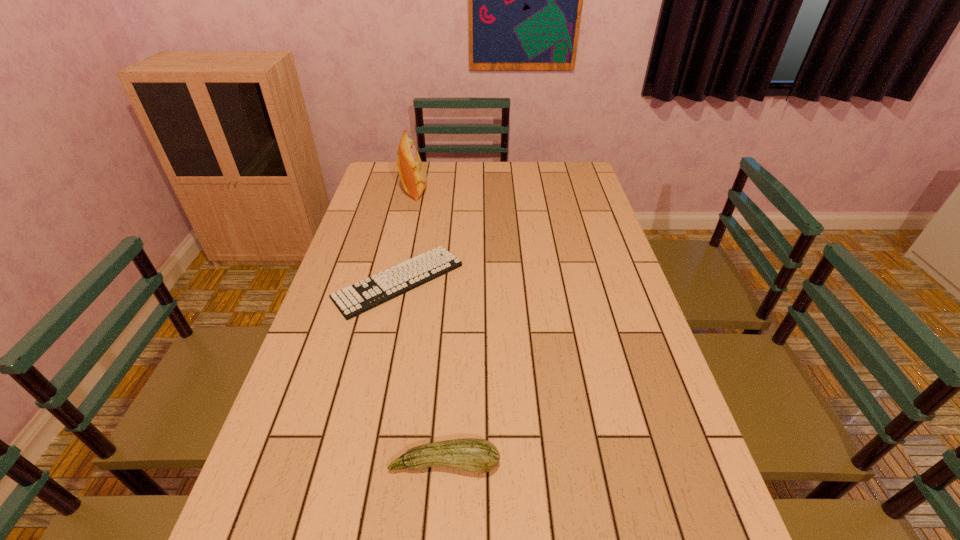
I want to click on empty location between the farthest object and the second nearest object, so click(x=406, y=236).

Where is `vacant point located between the shortest object and the second shortest object`? vacant point located between the shortest object and the second shortest object is located at coordinates (421, 372).

This screenshot has width=960, height=540. Find the location of `blank region between the tallest object and the nearest object`. blank region between the tallest object and the nearest object is located at coordinates click(430, 327).

The width and height of the screenshot is (960, 540). I want to click on unoccupied area between the zucchini and the crisp (potato chip), so 430,327.

The width and height of the screenshot is (960, 540). I want to click on empty location between the second farthest object and the farthest object, so click(x=406, y=236).

Find the location of a particular element. The height and width of the screenshot is (540, 960). free spot between the nearest object and the farthest object is located at coordinates (430, 327).

Image resolution: width=960 pixels, height=540 pixels. What are the coordinates of `vacant area between the computer keyboard and the second shortest object` in the screenshot? It's located at (421, 372).

I want to click on object that is the second closest to the zucchini, so click(413, 176).

You are a GUI agent. You are given a task and a screenshot of the screen. Output one action in this format:
    pyautogui.click(x=<x>, y=<y>)
    Task: Click on the object that is the second closest one to the crisp (potato chip)
    
    Given the screenshot: What is the action you would take?
    476,455

This screenshot has width=960, height=540. I want to click on blank area in the image that satisfies the following two spatial constraints: 1. on the front-facing side of the farthest object; 2. on the right side of the computer keyboard, so click(x=395, y=281).